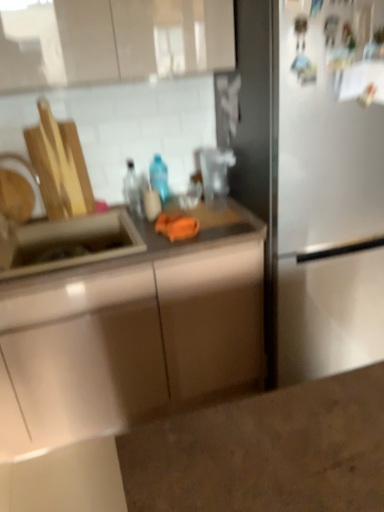
Question: From the image's perspective, does clear glass bottle at center, the 1th bottle in the left-to-right sequence, appear lower than stainless steel sink at left?

Choices:
 (A) no
 (B) yes

Answer: (A)

Question: Is clear glass bottle at center, the 1th bottle in the left-to-right sequence, taller than stainless steel sink at left?

Choices:
 (A) no
 (B) yes

Answer: (A)

Question: Does clear glass bottle at center, the 1th bottle in the left-to-right sequence, have a lesser height compared to stainless steel sink at left?

Choices:
 (A) yes
 (B) no

Answer: (A)

Question: Is clear glass bottle at center, which appears as the second bottle when viewed from the right, looking in the opposite direction of stainless steel sink at left?

Choices:
 (A) no
 (B) yes

Answer: (A)

Question: Considering the relative sizes of clear glass bottle at center, which appears as the second bottle when viewed from the right, and stainless steel sink at left in the image provided, is clear glass bottle at center, which appears as the second bottle when viewed from the right, wider than stainless steel sink at left?

Choices:
 (A) yes
 (B) no

Answer: (B)

Question: Is stainless steel sink at left completely or partially inside clear glass bottle at center, the 1th bottle in the left-to-right sequence?

Choices:
 (A) yes
 (B) no

Answer: (B)

Question: Is satin white fridge at right looking in the opposite direction of brushed metal faucet at left?

Choices:
 (A) yes
 (B) no

Answer: (B)

Question: Is satin white fridge at right far from brushed metal faucet at left?

Choices:
 (A) no
 (B) yes

Answer: (B)

Question: Can you confirm if satin white fridge at right is positioned to the left of brushed metal faucet at left?

Choices:
 (A) yes
 (B) no

Answer: (B)

Question: From a real-world perspective, is satin white fridge at right located higher than brushed metal faucet at left?

Choices:
 (A) no
 (B) yes

Answer: (A)

Question: Is satin white fridge at right wider than brushed metal faucet at left?

Choices:
 (A) no
 (B) yes

Answer: (B)

Question: Can you confirm if satin white fridge at right is bigger than brushed metal faucet at left?

Choices:
 (A) yes
 (B) no

Answer: (A)

Question: Does matte stainless steel sink at left have a greater height compared to translucent plastic bottle at center, marked as the 2th bottle in a left-to-right arrangement?

Choices:
 (A) yes
 (B) no

Answer: (B)